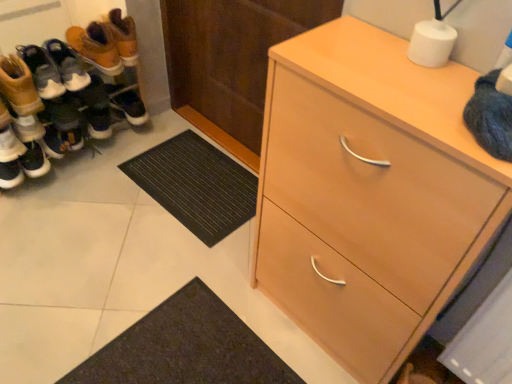
Where is `vacant area on top of light wood cabinet at right (from a real-world perspective)`? Image resolution: width=512 pixels, height=384 pixels. vacant area on top of light wood cabinet at right (from a real-world perspective) is located at coordinates (400, 70).